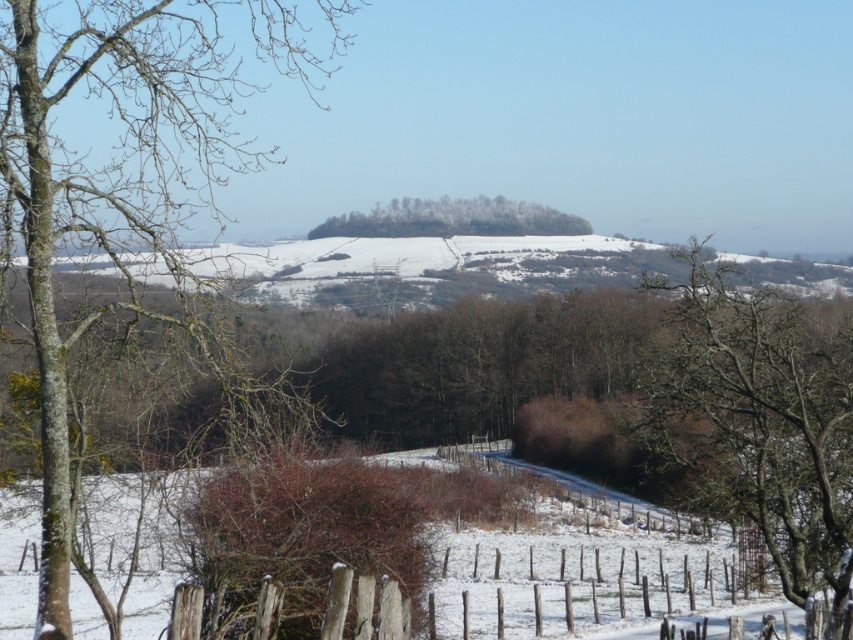
You are standing at the point labeled point (750, 472) and want to walk to the point labeled point (421, 228). Which direction should you move to get closer to your destination?

Since point (750, 472) is closer to the viewer than point (421, 228), you should move away from the viewer to reach your destination.

You are standing at the starting point of the wooden fence in the winter landscape. You see two points marked in the scene. The first point is at coordinates point (115, 45) and the second is at point (827, 422). If you want to walk towards the point that is closer to you, which coordinate should you head towards?

You should head towards point (115, 45) because it is in front of point (827, 422), making it closer to your current position.